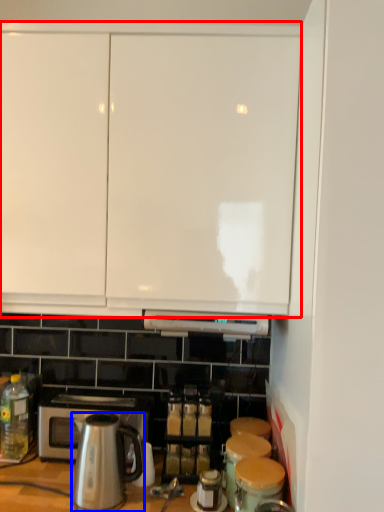
Question: Which of the following is the farthest to the observer, cabinetry (highlighted by a red box) or kitchen appliance (highlighted by a blue box)?

Choices:
 (A) cabinetry
 (B) kitchen appliance

Answer: (B)